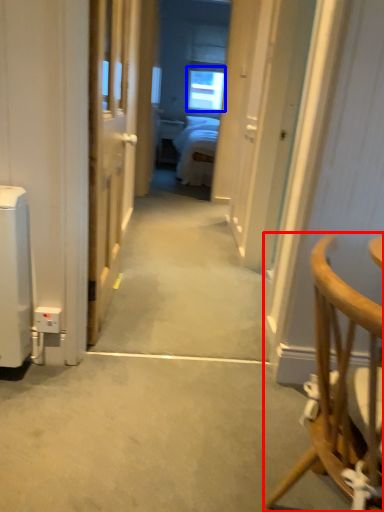
Question: Which object is closer to the camera taking this photo, chair (highlighted by a red box) or window (highlighted by a blue box)?

Choices:
 (A) chair
 (B) window

Answer: (A)